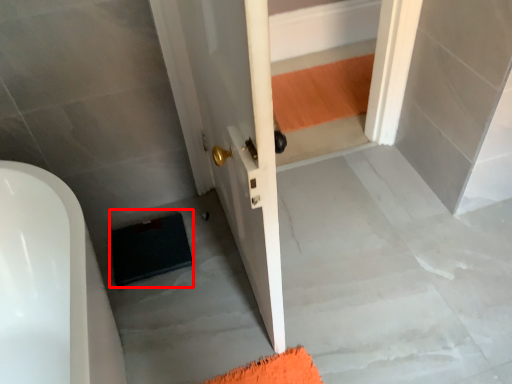
Question: Considering the relative positions of doormat (annotated by the red box) and concrete in the image provided, where is doormat (annotated by the red box) located with respect to the staircase?

Choices:
 (A) right
 (B) left

Answer: (B)